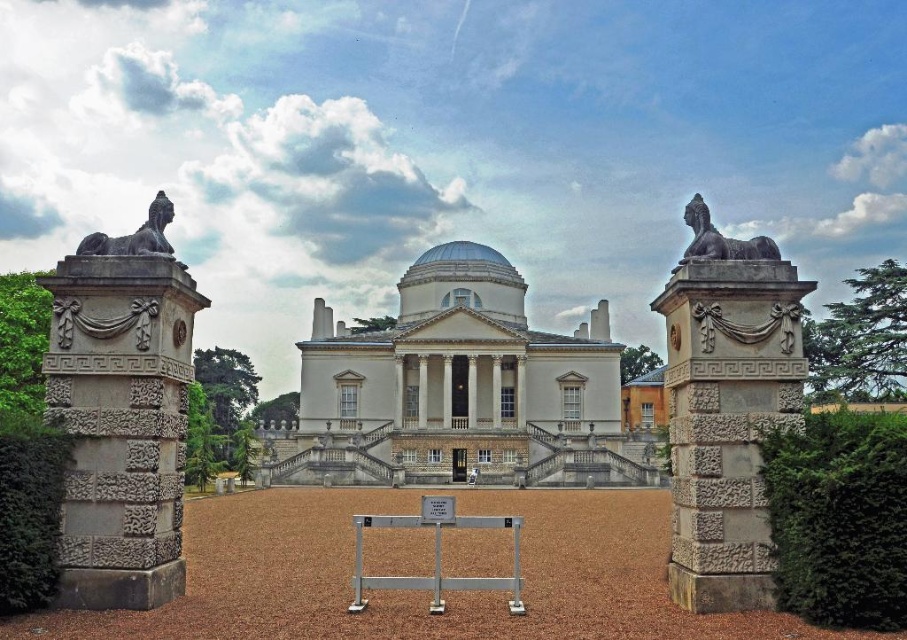
Question: Among these objects, which one is farthest from the camera?

Choices:
 (A) green leafy hedge at left
 (B) polished bronze sphinx at upper right
 (C) stone textured column at right

Answer: (B)

Question: Which of the following is the closest to the observer?

Choices:
 (A) green textured hedge at right
 (B) polished bronze sphinx at left

Answer: (A)

Question: Is green textured hedge at right below green leafy hedge at left?

Choices:
 (A) no
 (B) yes

Answer: (A)

Question: Which of the following is the closest to the observer?

Choices:
 (A) green textured hedge at right
 (B) polished bronze sphinx at upper right

Answer: (A)

Question: Can you confirm if stone textured column at right is wider than polished bronze sphinx at upper right?

Choices:
 (A) no
 (B) yes

Answer: (A)

Question: Does white stone mansion at center come in front of polished bronze sphinx at left?

Choices:
 (A) yes
 (B) no

Answer: (B)